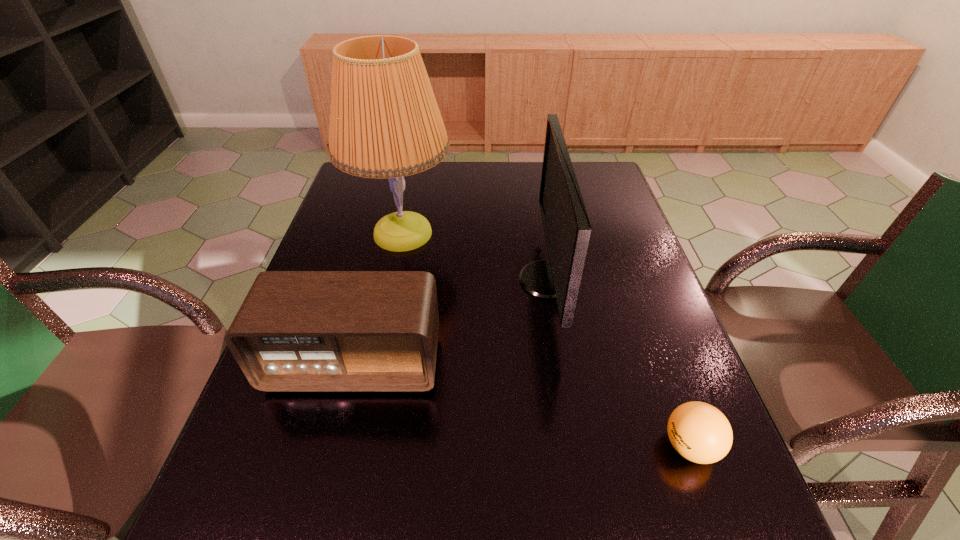
The image size is (960, 540). In the image, there is a desktop. In order to click on vacant space at the right edge in this screenshot , I will do `click(602, 291)`.

This screenshot has width=960, height=540. In the image, there is a desktop. In order to click on vacant space at the near right corner in this screenshot , I will do `click(706, 525)`.

I want to click on vacant space that's between the nearest object and the lamp, so pyautogui.click(x=546, y=340).

Locate an element on the screen. This screenshot has width=960, height=540. vacant space that is in between the second shortest object and the nearest object is located at coordinates (522, 404).

Locate an element on the screen. The width and height of the screenshot is (960, 540). vacant point located between the shortest object and the third tallest object is located at coordinates (522, 404).

You are a GUI agent. You are given a task and a screenshot of the screen. Output one action in this format:
    pyautogui.click(x=<x>, y=<y>)
    Task: Click on the vacant space in between the third shortest object and the lamp
    
    Given the screenshot: What is the action you would take?
    pyautogui.click(x=475, y=256)

Locate an element on the screen. empty space between the third tallest object and the second object from right to left is located at coordinates (450, 321).

This screenshot has height=540, width=960. Identify the location of empty space that is in between the radio receiver and the rightmost object. (522, 404).

Find the location of a particular element. free space between the ping-pong ball and the tallest object is located at coordinates (546, 340).

Where is `free point between the second shortest object and the third object from left to right`? The height and width of the screenshot is (540, 960). free point between the second shortest object and the third object from left to right is located at coordinates (450, 321).